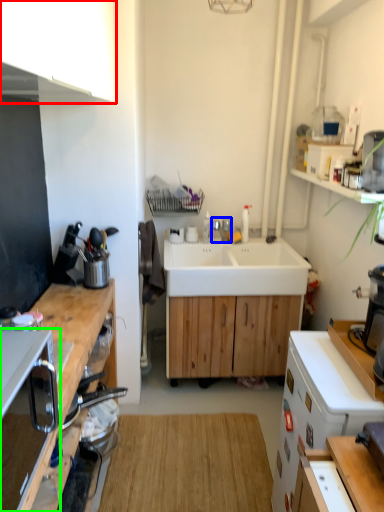
Question: Based on their relative distances, which object is nearer to cabinetry (highlighted by a red box)? Choose from tap (highlighted by a blue box) and corded phone (highlighted by a green box).

Choices:
 (A) tap
 (B) corded phone

Answer: (B)